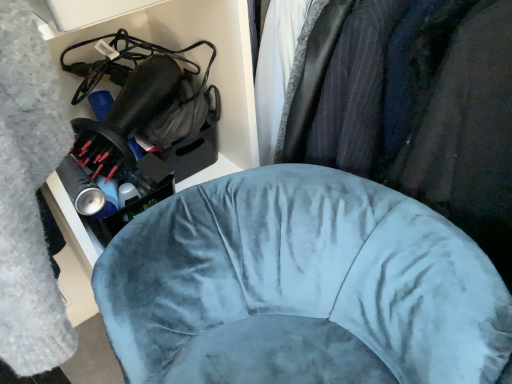
Question: From the image's perspective, is velvet blue chair at center above or below velvet blue chair at center?

Choices:
 (A) below
 (B) above

Answer: (B)

Question: Considering the positions of velvet blue chair at center and velvet blue chair at center in the image, is velvet blue chair at center bigger or smaller than velvet blue chair at center?

Choices:
 (A) small
 (B) big

Answer: (B)

Question: Considering the relative positions of velvet blue chair at center and velvet blue chair at center in the image provided, is velvet blue chair at center to the left or to the right of velvet blue chair at center?

Choices:
 (A) left
 (B) right

Answer: (B)

Question: Considering the positions of velvet blue chair at center and velvet blue chair at center in the image, is velvet blue chair at center wider or thinner than velvet blue chair at center?

Choices:
 (A) thin
 (B) wide

Answer: (A)

Question: Is velvet blue chair at center in front of or behind velvet blue chair at center in the image?

Choices:
 (A) front
 (B) behind

Answer: (B)

Question: From their relative heights in the image, would you say velvet blue chair at center is taller or shorter than velvet blue chair at center?

Choices:
 (A) short
 (B) tall

Answer: (B)

Question: Does point (425, 334) appear closer or farther from the camera than point (390, 13)?

Choices:
 (A) closer
 (B) farther

Answer: (A)